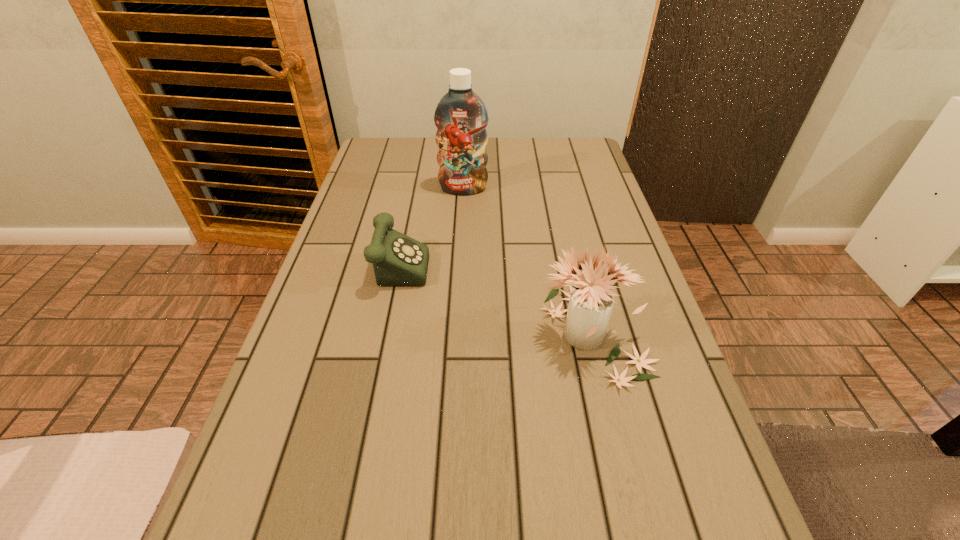
Locate an element on the screen. The image size is (960, 540). the tallest object is located at coordinates (461, 117).

The height and width of the screenshot is (540, 960). I want to click on the farthest object, so click(x=461, y=117).

You are a GUI agent. You are given a task and a screenshot of the screen. Output one action in this format:
    pyautogui.click(x=<x>, y=<y>)
    Task: Click on the bouquet
    This screenshot has height=540, width=960.
    Given the screenshot: What is the action you would take?
    pyautogui.click(x=591, y=301)

The height and width of the screenshot is (540, 960). I want to click on the rightmost object, so click(x=591, y=301).

Find the location of a particular element. The image size is (960, 540). telephone is located at coordinates (398, 260).

Identify the location of the shortest object. (398, 260).

Locate an element on the screen. This screenshot has width=960, height=540. vacant space situated on the front label of the tallest object is located at coordinates (462, 225).

The height and width of the screenshot is (540, 960). Find the location of `free space located on the back of the second shortest object`. free space located on the back of the second shortest object is located at coordinates (565, 222).

The width and height of the screenshot is (960, 540). In order to click on vacant space located 0.140m on the dial of the telephone in this screenshot , I will do `click(487, 260)`.

Locate an element on the screen. The width and height of the screenshot is (960, 540). object situated at the left edge is located at coordinates (398, 260).